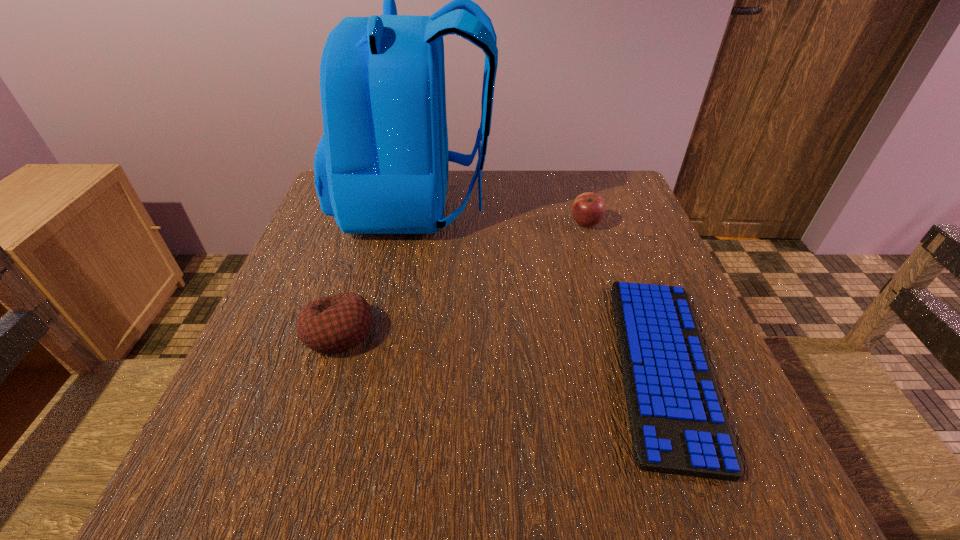
At what (x,y) coordinates should I click in order to perform the action: click on the tallest object. Please return your answer as a coordinate pair (x, y). Looking at the image, I should click on (381, 167).

The image size is (960, 540). Identify the location of apple. point(588,209).

Locate an element on the screen. This screenshot has width=960, height=540. the second shortest object is located at coordinates (339, 322).

Where is `computer keyboard`? computer keyboard is located at coordinates (678, 423).

I want to click on free space located on the back of the backpack, so click(641, 204).

Where is `free point located 0.250m on the front of the apple`? free point located 0.250m on the front of the apple is located at coordinates (613, 312).

The image size is (960, 540). In order to click on free space located on the front of the second shortest object in this screenshot , I will do `click(290, 487)`.

You are a GUI agent. You are given a task and a screenshot of the screen. Output one action in this format:
    pyautogui.click(x=<x>, y=<y>)
    Task: Click on the free spot located on the back of the computer keyboard
    The height and width of the screenshot is (540, 960).
    Given the screenshot: What is the action you would take?
    coord(600,199)

Find the location of `backpack located in the far edge section of the desktop`. backpack located in the far edge section of the desktop is located at coordinates (381, 167).

This screenshot has width=960, height=540. In order to click on apple positioned at the far edge in this screenshot , I will do `click(588, 209)`.